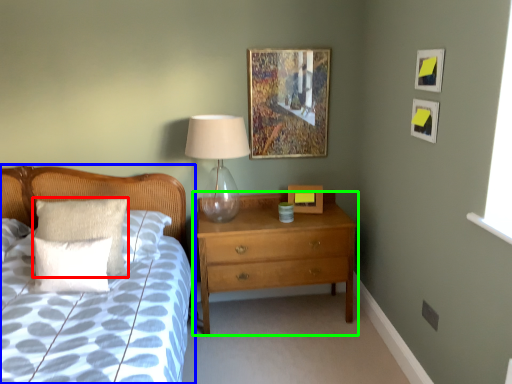
Question: Estimate the real-world distances between objects in this image. Which object is farther from pillow (highlighted by a red box), bed (highlighted by a blue box) or chest of drawers (highlighted by a green box)?

Choices:
 (A) bed
 (B) chest of drawers

Answer: (B)